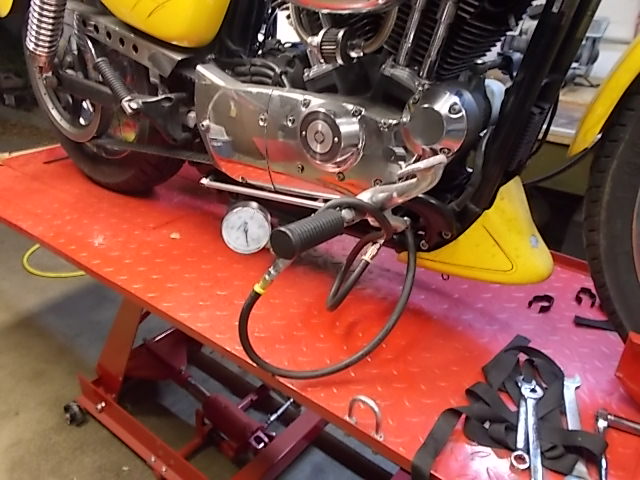
Locate an element on the screen. Image resolution: width=640 pixels, height=480 pixels. black cord is located at coordinates (354, 357).